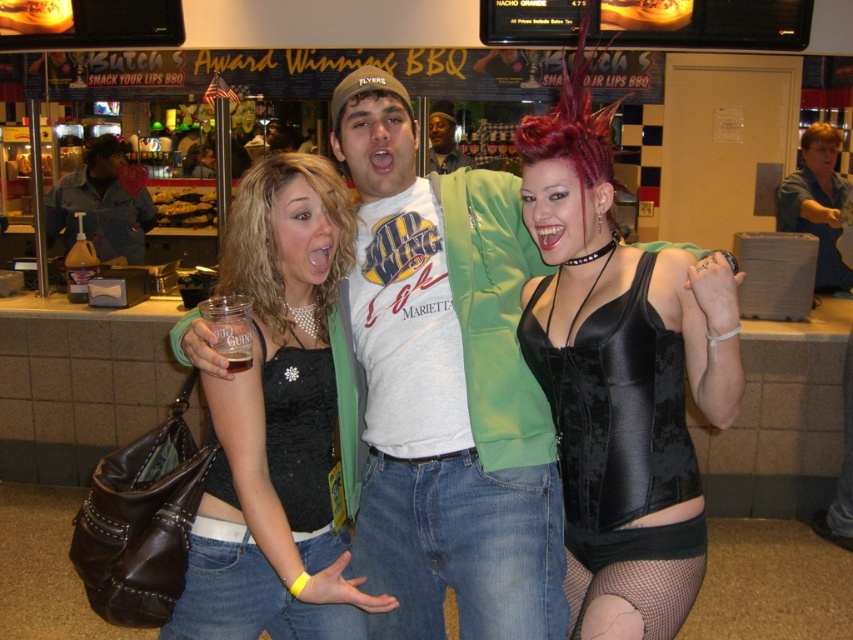
You are a bartender in a busy bar. You have to place both the shiny black corset at center and the translucent plastic cup at center on a shelf that can only hold items smaller than the corset. Can both items fit on the shelf?

The shiny black corset at center is larger in size than the translucent plastic cup at center. Since the shelf can only hold items smaller than the corset, the translucent plastic cup at center can fit, but the corset cannot. Therefore, only the translucent plastic cup at center can be placed on the shelf.